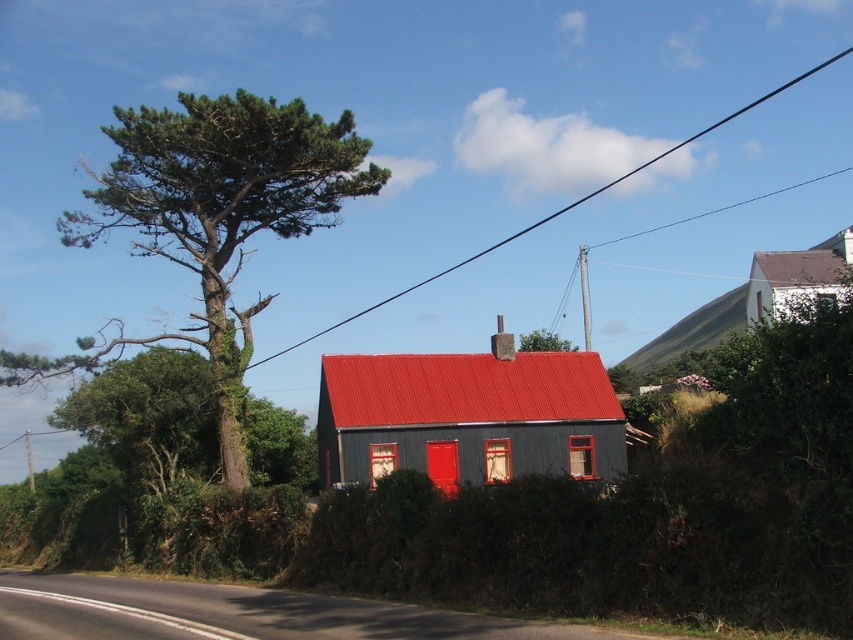
You are a painter who needs to decide which object to paint first between the red corrugated metal house at center and the gray slate roof at upper right. Since you want to paint the wider object first, which one should you choose?

The gray slate roof at upper right is wider than the red corrugated metal house at center, so you should paint the gray slate roof at upper right first.

You are standing at the point marked by coordinates point [468,416]. Looking around, you see the red corrugated metal house at center. Which direction should you face to see the tall, slender tree with sparse foliage to the left of the house?

You should face to the left to see the tall, slender tree with sparse foliage to the left of the house, as the tree is located to the left side of the house relative to your position at point [468,416].